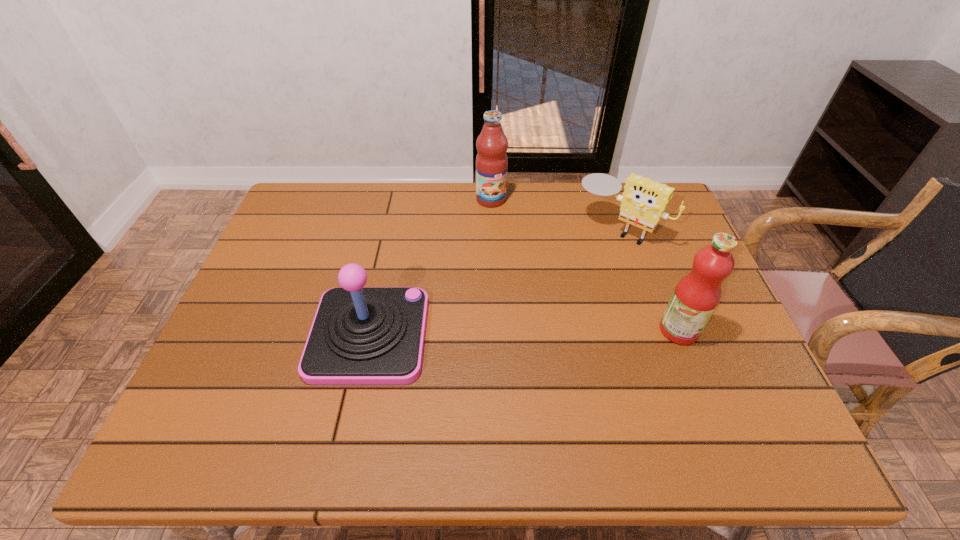
Locate an element on the screen. Image resolution: width=960 pixels, height=540 pixels. blank region between the nearer fruit juice and the leftmost object is located at coordinates (524, 333).

Identify the location of vacant space that is in between the sponge and the right fruit juice. (648, 280).

Find the location of `free space between the joystick and the farther fruit juice`. free space between the joystick and the farther fruit juice is located at coordinates (430, 267).

At what (x,y) coordinates should I click in order to perform the action: click on vacant area that lies between the sponge and the second shortest object. Please return your answer as a coordinate pair (x, y). Looking at the image, I should click on (493, 282).

Identify the location of free space that is in between the left fruit juice and the shortest object. (555, 214).

At what (x,y) coordinates should I click in order to perform the action: click on free spot between the joystick and the second object from left to right. Please return your answer as a coordinate pair (x, y). Image resolution: width=960 pixels, height=540 pixels. Looking at the image, I should click on point(430,267).

Locate which object is the second closest to the leftmost object. Please provide its 2D coordinates. Your answer should be formatted as a tuple, i.e. [(x, y)], where the tuple contains the x and y coordinates of a point satisfying the conditions above.

[(643, 202)]

In order to click on the third closest object to the third tallest object in this screenshot , I will do `click(696, 296)`.